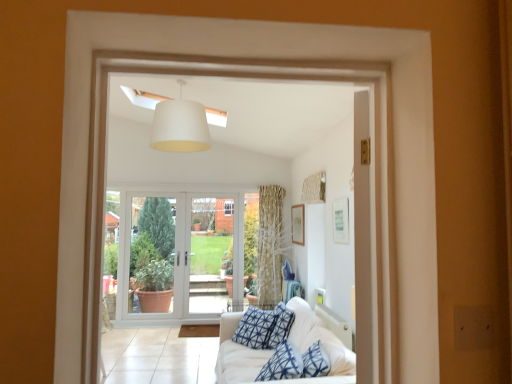
Question: From the image's perspective, relative to white plastic window frame at center, is white glass door at center, which is counted as the 2th screen door, starting from the left, above or below?

Choices:
 (A) above
 (B) below

Answer: (B)

Question: Based on their positions, is white glass door at center, which is counted as the 2th screen door, starting from the left, located to the left or right of white plastic window frame at center?

Choices:
 (A) right
 (B) left

Answer: (B)

Question: Which object is the closest to the clear glass door at center, which ranks as the second screen door in right-to-left order?

Choices:
 (A) wooden picture frame at upper center, which ranks as the 2th picture frame in left-to-right order
 (B) white matte lampshade at upper center
 (C) white plastic window frame at center
 (D) wooden picture frame at upper right, which is the 2th picture frame in front-to-back order
 (E) white fabric couch at lower right

Answer: (C)

Question: Which object is the closest to the patterned fabric curtain at upper right?

Choices:
 (A) wooden picture frame at upper right, which is the 2th picture frame from right to left
 (B) white matte lampshade at upper center
 (C) wooden picture frame at upper center, placed as the 2th picture frame when sorted from back to front
 (D) white glass door at center, the 1th screen door positioned from the right
 (E) clear glass door at center, the 1th screen door viewed from the left

Answer: (A)